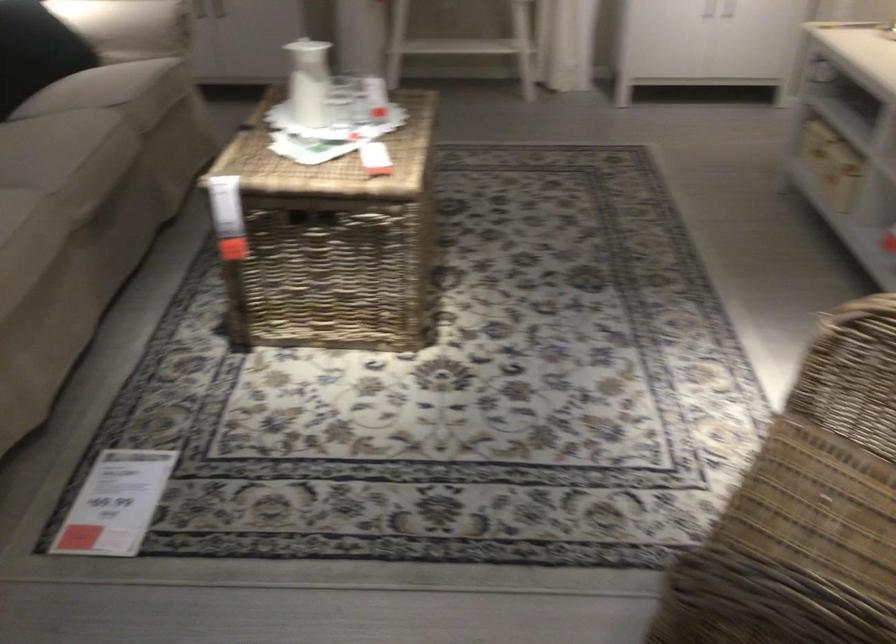
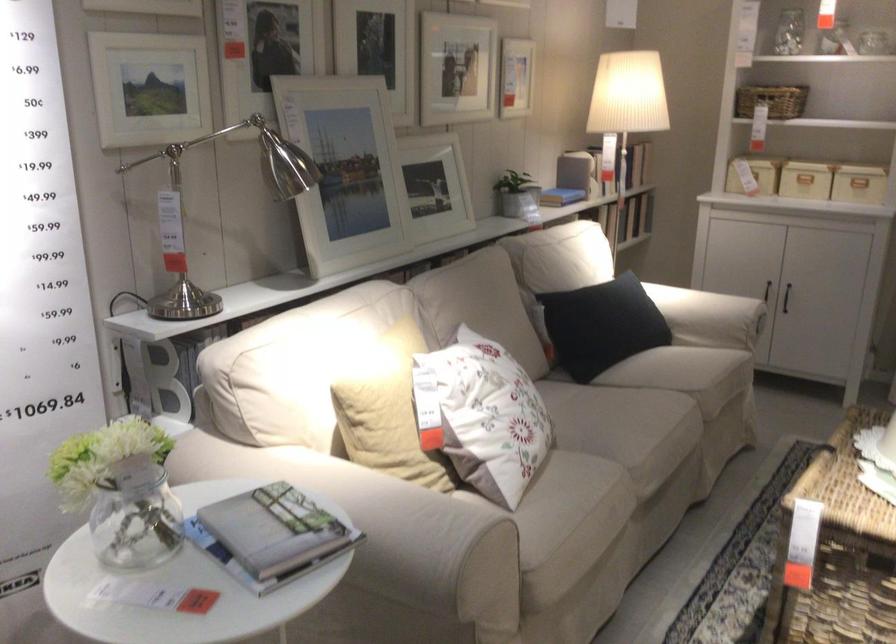
Find the pixel in the second image that matches (261,218) in the first image.

(839, 552)